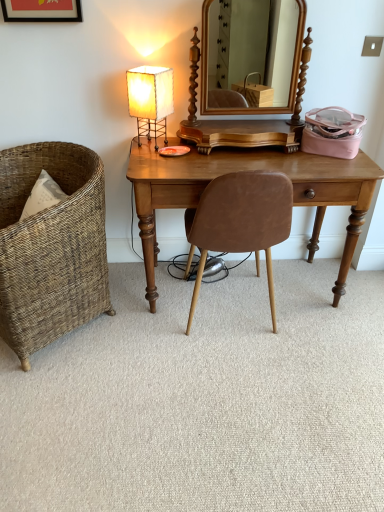
Locate an element on the screen. The image size is (384, 512). vacant space underneath light brown wood desk at center (from a real-world perspective) is located at coordinates coord(258,282).